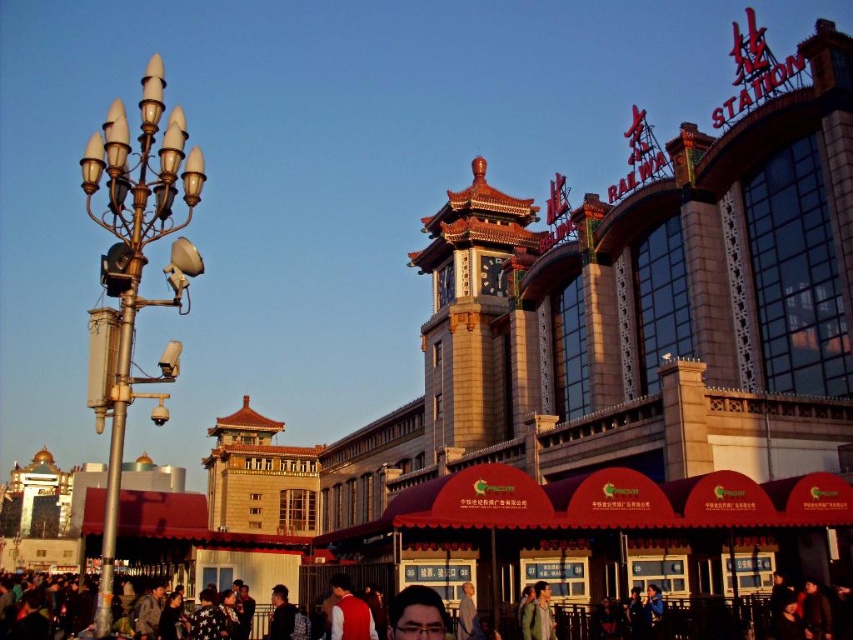
Who is more distant from viewer, (167,376) or (685,627)?

Positioned behind is point (685,627).

Does point (109, 316) lie in front of point (672, 627)?

Yes, point (109, 316) is closer to viewer.

Where is `gold metallic streetlight at left`? The width and height of the screenshot is (853, 640). gold metallic streetlight at left is located at coordinates (134, 275).